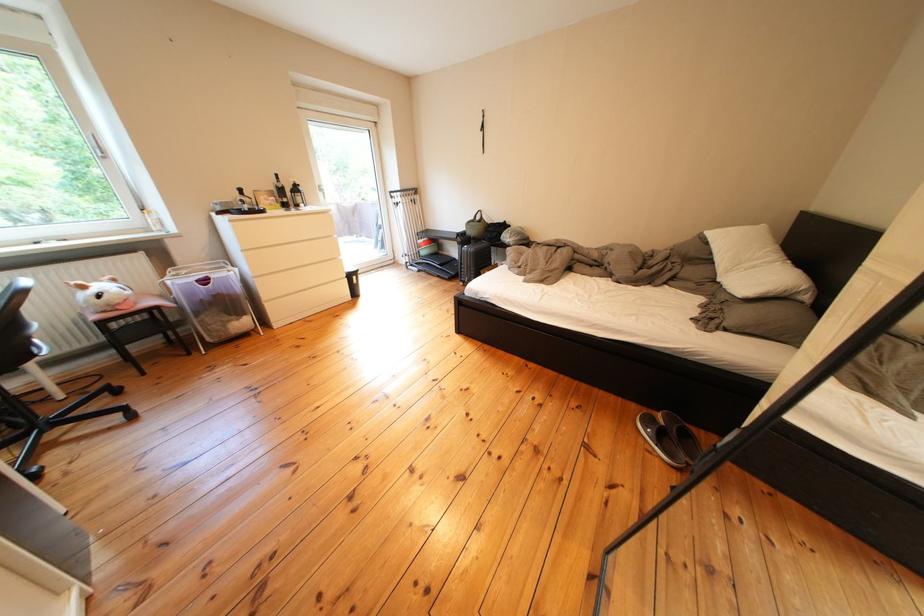
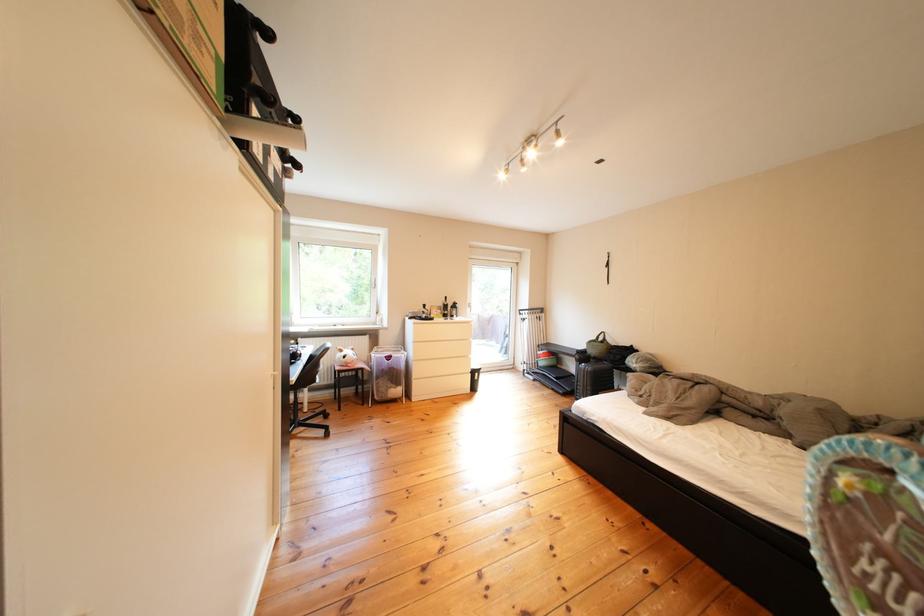
The point at (x=458, y=257) is marked in the first image. Where is the corresponding point in the second image?

(578, 371)